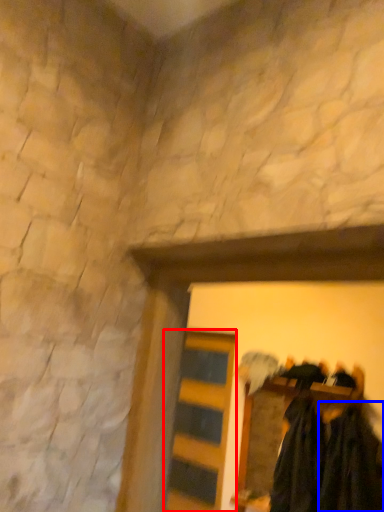
Question: Which of the following is the farthest to the observer, barn door (highlighted by a red box) or clothing (highlighted by a blue box)?

Choices:
 (A) barn door
 (B) clothing

Answer: (A)